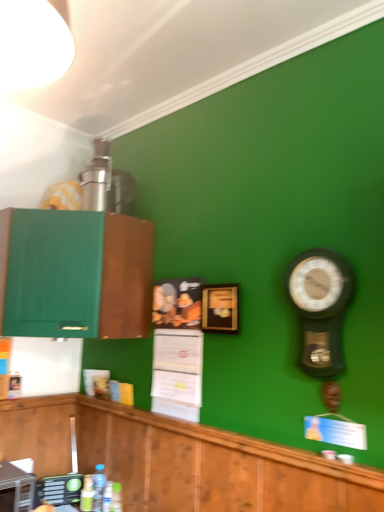
In order to click on free spot above wooden cabinetry at lower left, the 2th cabinetry positioned from the top (from a real-world perspective) in this screenshot , I will do tap(210, 421).